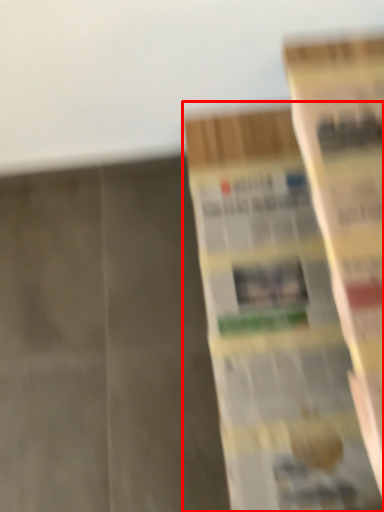
Question: From the image's perspective, what is the correct spatial relationship of book (annotated by the red box) in relation to book?

Choices:
 (A) below
 (B) above

Answer: (A)